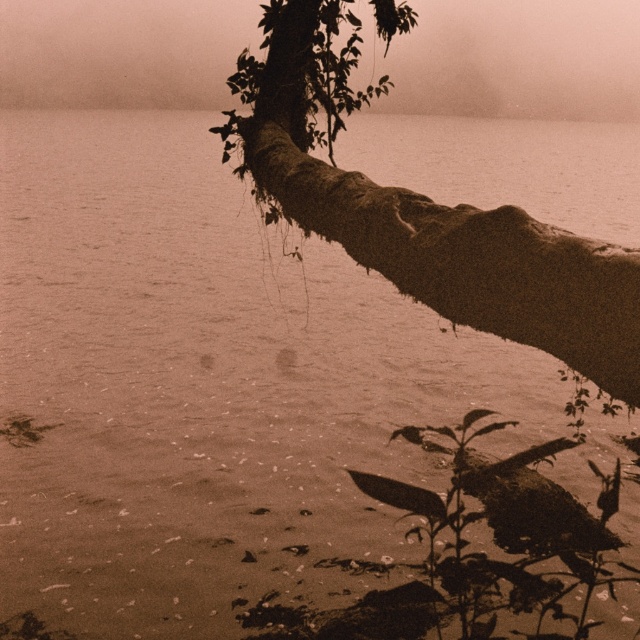
Does point (394, 275) come behind point (227, 104)?

That is False.

Is rough bark branch at upper right above foggy mist at upper center?

Incorrect, rough bark branch at upper right is not positioned above foggy mist at upper center.

What do you see at coordinates (422, 211) in the screenshot? This screenshot has width=640, height=640. I see `rough bark branch at upper right` at bounding box center [422, 211].

Find the location of a particular element. Image resolution: width=640 pixels, height=640 pixels. rough bark branch at upper right is located at coordinates (422, 211).